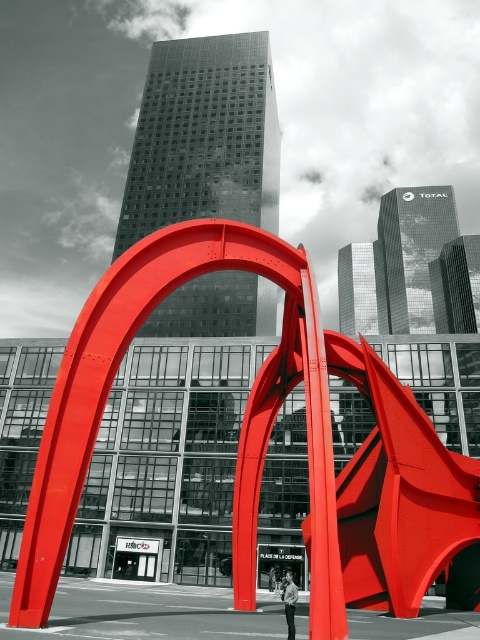
Question: Which point is closer to the camera?

Choices:
 (A) (392, 444)
 (B) (292, 621)

Answer: (B)

Question: Which point appears closest to the camera in this image?

Choices:
 (A) (285, 588)
 (B) (443, 490)

Answer: (A)

Question: Can you confirm if metallic red arch at center is positioned above light brown leather jacket at center?

Choices:
 (A) yes
 (B) no

Answer: (A)

Question: Which point is closer to the camera?

Choices:
 (A) light brown leather jacket at center
 (B) metallic red arch at center

Answer: (B)

Question: Does metallic red arch at center have a lesser width compared to light brown leather jacket at center?

Choices:
 (A) yes
 (B) no

Answer: (B)

Question: Can you confirm if metallic red arch at center is positioned to the right of light brown leather jacket at center?

Choices:
 (A) yes
 (B) no

Answer: (A)